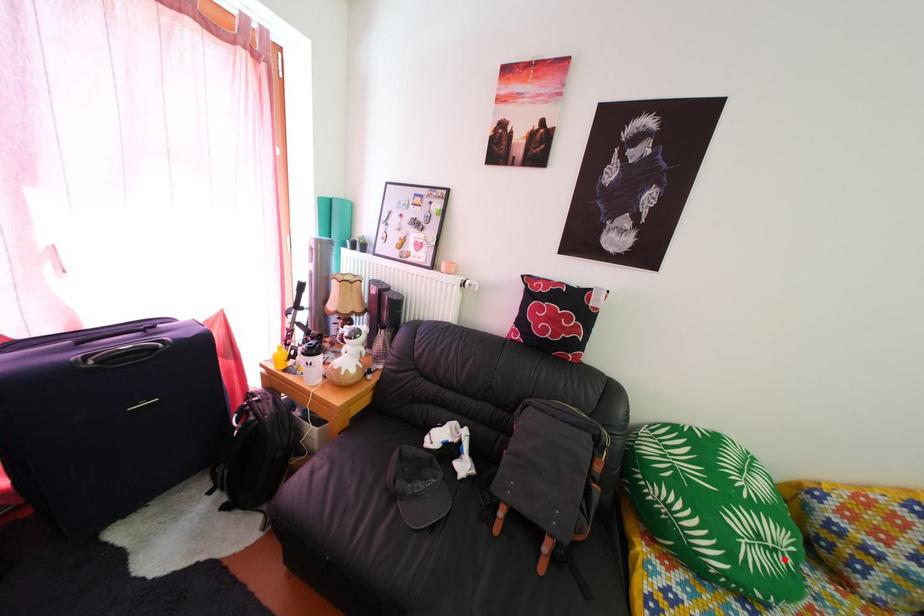
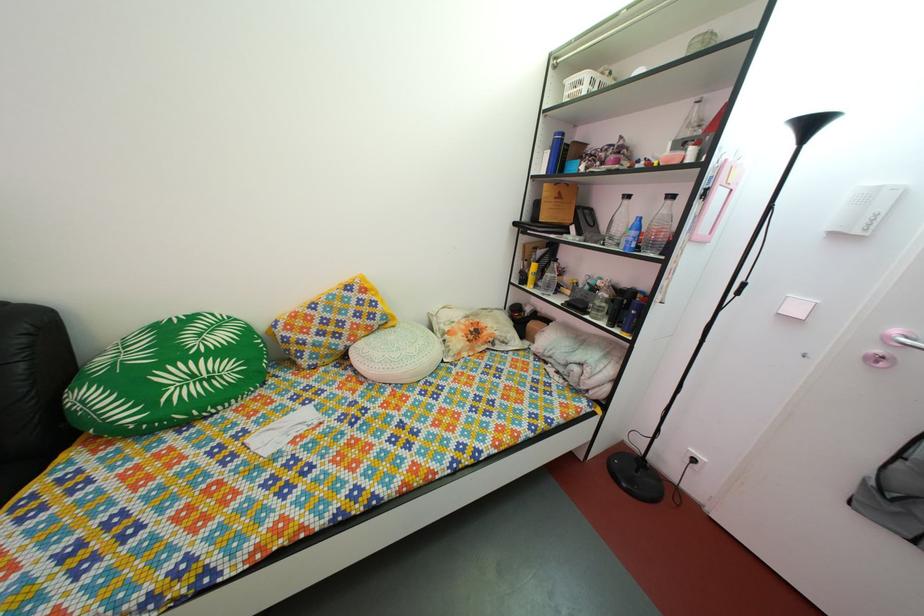
Question: I am providing you with two images of the same scene from different viewpoints. Given a red point in image1, look at the same physical point in image2. Is it:

Choices:
 (A) Closer to the viewpoint
 (B) Farther from the viewpoint

Answer: (B)